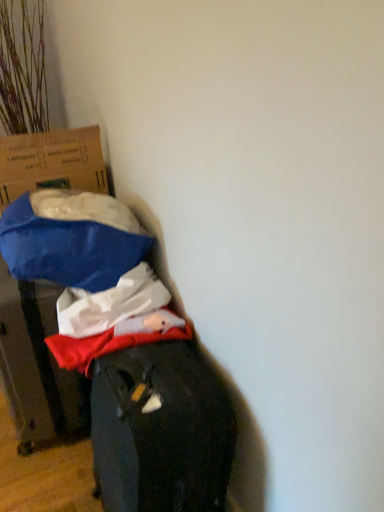
Question: Can you confirm if blue fabric bag at left, the 1th cardboard box positioned from the bottom, is positioned to the left of blue cardboard box at left, arranged as the second cardboard box when ordered from the bottom?

Choices:
 (A) yes
 (B) no

Answer: (B)

Question: Is the position of blue fabric bag at left, the 1th cardboard box positioned from the bottom, more distant than that of blue cardboard box at left, arranged as the second cardboard box when ordered from the bottom?

Choices:
 (A) yes
 (B) no

Answer: (B)

Question: From a real-world perspective, is blue fabric bag at left, the 1th cardboard box positioned from the bottom, beneath blue cardboard box at left, arranged as the second cardboard box when ordered from the bottom?

Choices:
 (A) yes
 (B) no

Answer: (A)

Question: Does blue fabric bag at left, the 1th cardboard box positioned from the bottom, appear on the right side of blue cardboard box at left, arranged as the second cardboard box when ordered from the bottom?

Choices:
 (A) no
 (B) yes

Answer: (B)

Question: Does blue fabric bag at left, the 1th cardboard box positioned from the bottom, have a lesser width compared to blue cardboard box at left, the first cardboard box when ordered from top to bottom?

Choices:
 (A) yes
 (B) no

Answer: (B)

Question: Would you say blue cardboard box at left, the first cardboard box when ordered from top to bottom, is part of blue fabric bag at left, the 2th cardboard box when ordered from top to bottom,'s contents?

Choices:
 (A) yes
 (B) no

Answer: (B)

Question: Is the depth of blue cardboard box at left, the first cardboard box when ordered from top to bottom, greater than that of blue fabric bag at left, the 1th cardboard box positioned from the bottom?

Choices:
 (A) no
 (B) yes

Answer: (B)

Question: Does blue cardboard box at left, the first cardboard box when ordered from top to bottom, lie in front of blue fabric bag at left, the 1th cardboard box positioned from the bottom?

Choices:
 (A) yes
 (B) no

Answer: (B)

Question: From a real-world perspective, is blue cardboard box at left, arranged as the second cardboard box when ordered from the bottom, on top of blue fabric bag at left, the 1th cardboard box positioned from the bottom?

Choices:
 (A) no
 (B) yes

Answer: (B)

Question: From a real-world perspective, is blue cardboard box at left, arranged as the second cardboard box when ordered from the bottom, beneath blue fabric bag at left, the 1th cardboard box positioned from the bottom?

Choices:
 (A) yes
 (B) no

Answer: (B)

Question: Is blue cardboard box at left, the first cardboard box when ordered from top to bottom, at the right side of blue fabric bag at left, the 2th cardboard box when ordered from top to bottom?

Choices:
 (A) no
 (B) yes

Answer: (A)

Question: Is blue cardboard box at left, arranged as the second cardboard box when ordered from the bottom, outside of blue fabric bag at left, the 1th cardboard box positioned from the bottom?

Choices:
 (A) no
 (B) yes

Answer: (B)

Question: Is blue fabric bag at left, the 1th cardboard box positioned from the bottom, wider or thinner than blue cardboard box at left, the first cardboard box when ordered from top to bottom?

Choices:
 (A) wide
 (B) thin

Answer: (A)